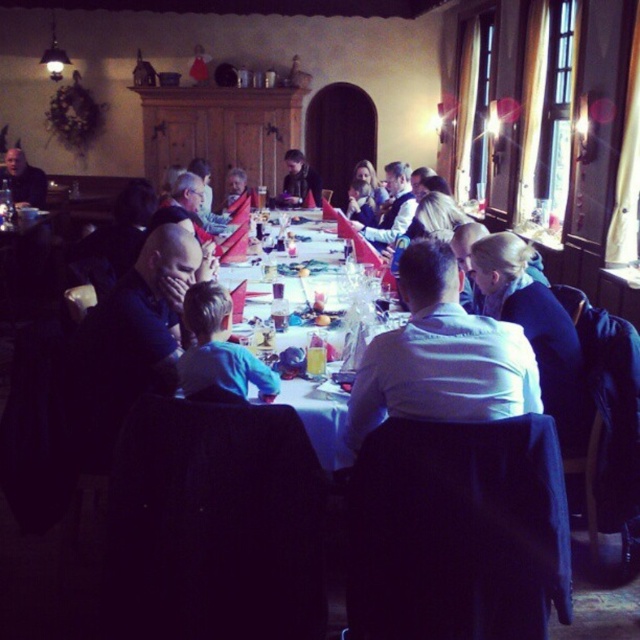
You are standing in the dining room and want to locate the blue cotton shirt at center. According to the coordinates provided, where would you find it?

The blue cotton shirt at center is located at the 2D coordinates point (x=218, y=348).

You are a guest at this festive dinner and want to choose a shirt to wear for the event. You see a white shirt at center and a blue cotton shirt at center. Which shirt is positioned higher on your body?

The white shirt at center is positioned higher on your body as it is above the blue cotton shirt at center.